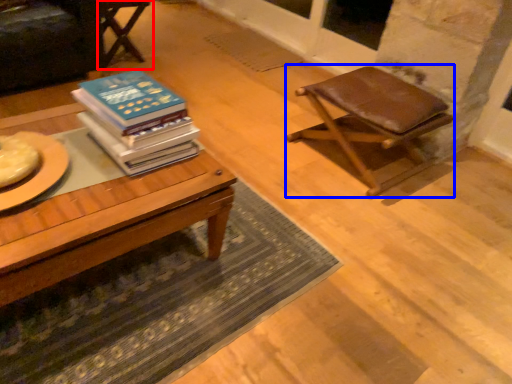
Question: Among these objects, which one is farthest to the camera, chair (highlighted by a red box) or stool (highlighted by a blue box)?

Choices:
 (A) chair
 (B) stool

Answer: (A)